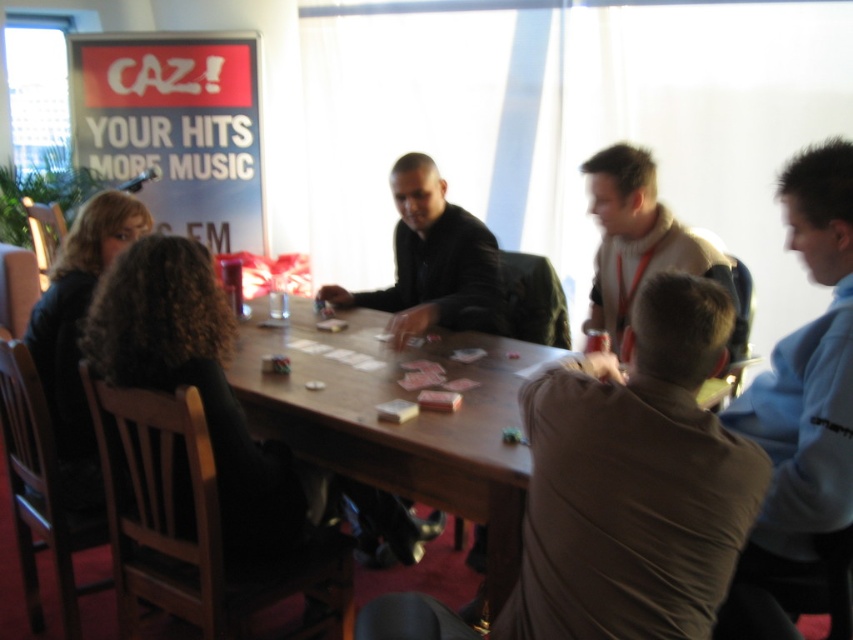
Which is below, black leather jacket at center or light beige sweater at center?

light beige sweater at center

Between point (476, 547) and point (595, 280), which one is positioned in front?

Positioned in front is point (595, 280).

Between point (456, 301) and point (618, 259), which one is positioned in front?

Point (618, 259) is in front.

The height and width of the screenshot is (640, 853). Find the location of `black leather jacket at center`. black leather jacket at center is located at coordinates (432, 260).

Is wooden at center positioned behind light beige sweater at center?

No, it is not.

Is wooden at center thinner than light beige sweater at center?

No.

Does point (312, 371) lie in front of point (720, 275)?

No, it is behind (720, 275).

Image resolution: width=853 pixels, height=640 pixels. Find the location of `wooden at center`. wooden at center is located at coordinates (399, 422).

Is wooden at center positioned before black leather jacket at center?

Yes, it is in front of black leather jacket at center.

Consider the image. Which is more to the right, wooden at center or black leather jacket at center?

Positioned to the right is wooden at center.

Identify the location of wooden at center. This screenshot has width=853, height=640. (399, 422).